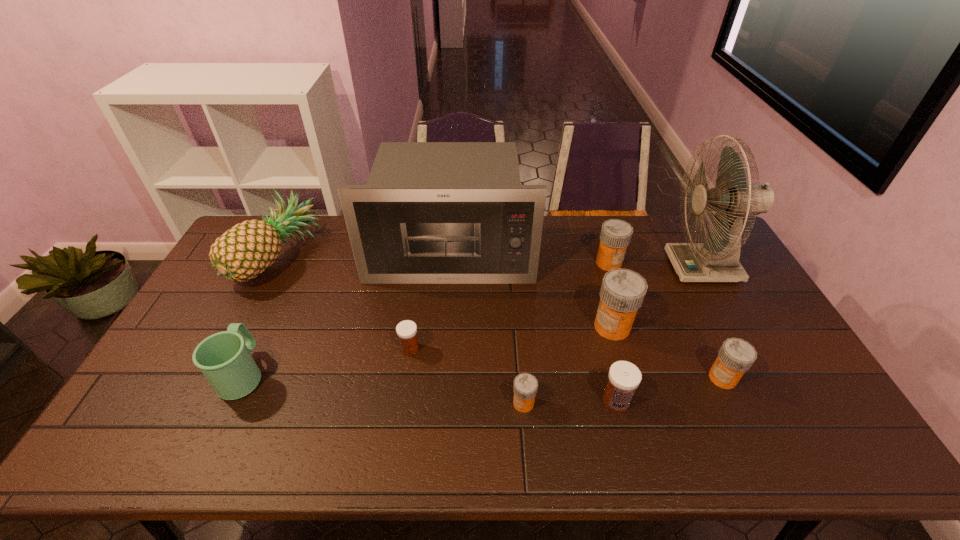
Identify which object is located as the nearest to the farther white medicine. Please provide its 2D coordinates. Your answer should be formatted as a tuple, i.e. [(x, y)], where the tuple contains the x and y coordinates of a point satisfying the conditions above.

[(431, 212)]

Identify the location of medicine that is the sixth closest to the green mug. The image size is (960, 540). (736, 356).

Identify which medicine is the second closest to the left white medicine. Please provide its 2D coordinates. Your answer should be formatted as a tuple, i.e. [(x, y)], where the tuple contains the x and y coordinates of a point satisfying the conditions above.

[(624, 377)]

Find the location of a particular element. orange medicine that is the fourth closest to the smaller white medicine is located at coordinates (736, 356).

Where is `the closest orange medicine to the biggest orange medicine`? The width and height of the screenshot is (960, 540). the closest orange medicine to the biggest orange medicine is located at coordinates (736, 356).

Locate an element on the screen. The height and width of the screenshot is (540, 960). free spot that satisfies the following two spatial constraints: 1. on the front-facing side of the fan; 2. on the front side of the left white medicine is located at coordinates (748, 348).